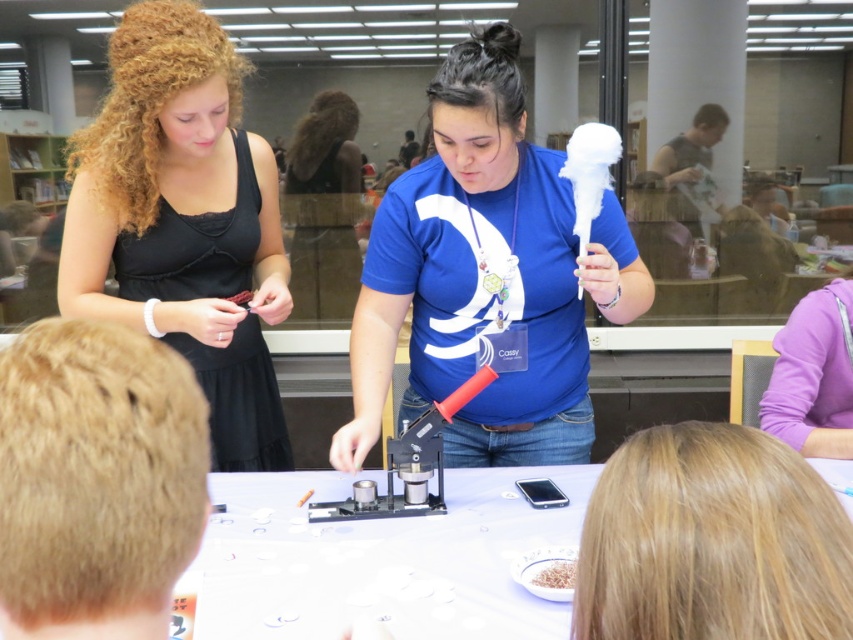
You are a visitor in the library and see the blue cotton candy at center and the blonde hair at lower right on the table. Which object is located to the left of the other?

The blue cotton candy at center is positioned on the left side of blonde hair at lower right.

You are organizing a fashion show and need to place the black satin dress at upper left and the brown crumbly food at center on a display table. According to the scene, which item should be placed to the left of the other?

The black satin dress at upper left should be placed to the left of the brown crumbly food at center because it is positioned on the left side of it in the scene.

You are organizing a craft fair and need to place the blue cotton candy at center and the blonde hair at lower right on a display table. Given their sizes, which object should you place first to ensure stability?

The blue cotton candy at center should be placed first because it is larger and requires more space, ensuring stability before placing the smaller blonde hair at lower right.